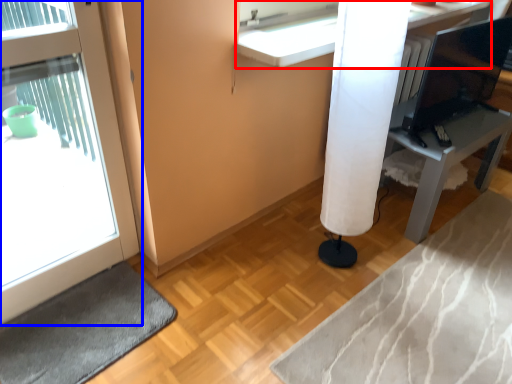
Question: Which object is closer to the camera taking this photo, counter (highlighted by a red box) or door (highlighted by a blue box)?

Choices:
 (A) counter
 (B) door

Answer: (B)